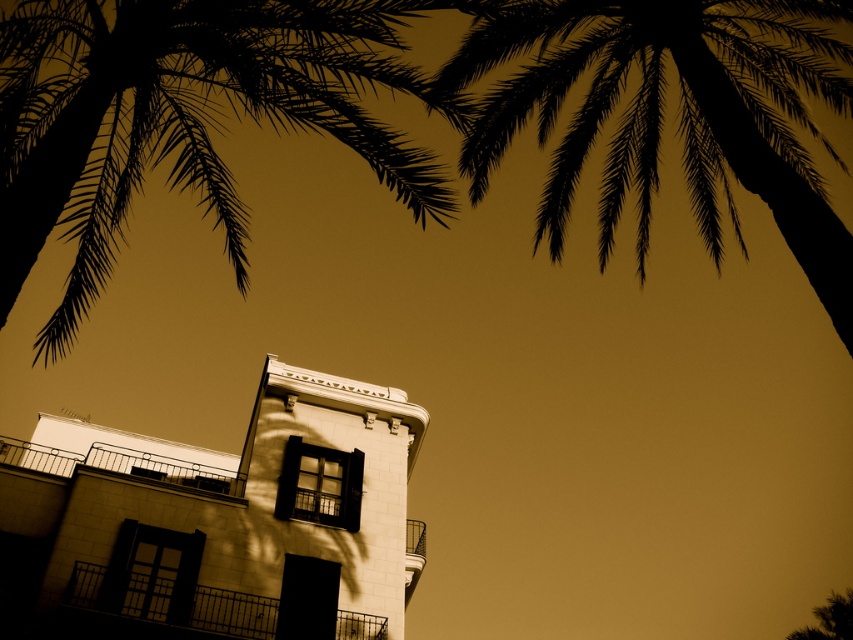
Question: Can you confirm if silhouette leafy palm at upper left is wider than black silhouette palm tree at upper right?

Choices:
 (A) no
 (B) yes

Answer: (A)

Question: Can you confirm if silhouette leafy palm at upper left is positioned below black silhouette palm tree at upper right?

Choices:
 (A) yes
 (B) no

Answer: (A)

Question: Which point is closer to the camera?

Choices:
 (A) silhouette leafy palm at upper left
 (B) black silhouette palm tree at upper right

Answer: (A)

Question: Does silhouette leafy palm at upper left have a lesser width compared to black silhouette palm tree at upper right?

Choices:
 (A) no
 (B) yes

Answer: (B)